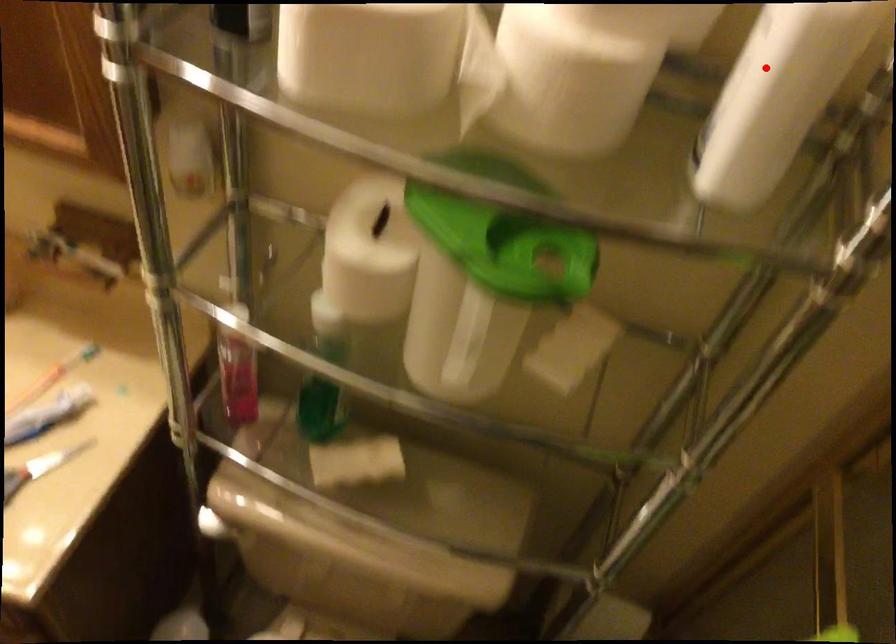
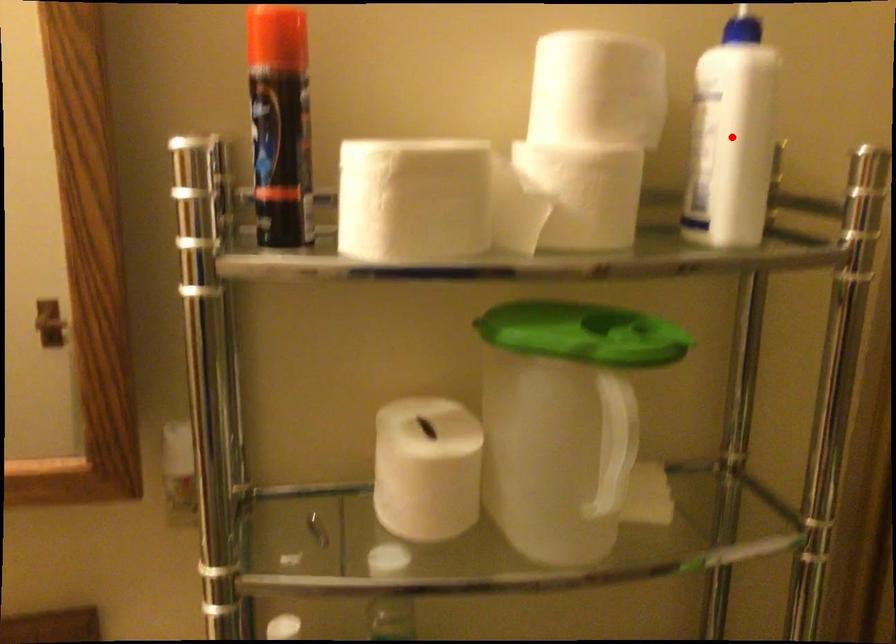
I am providing you with two images of the same scene from different viewpoints. A red point is marked on the first image and another point is marked on the second image. Is the marked point in image1 the same physical position as the marked point in image2?

Yes